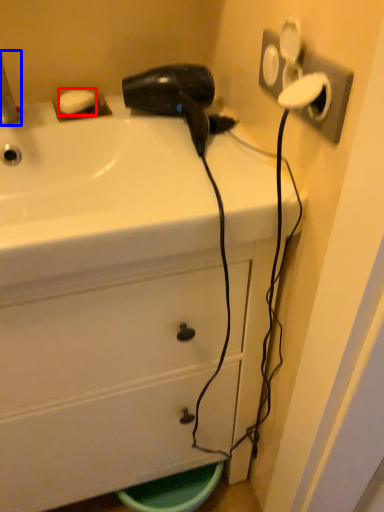
Question: Which object appears closest to the camera in this image, soap (highlighted by a red box) or faucet (highlighted by a blue box)?

Choices:
 (A) soap
 (B) faucet

Answer: (B)